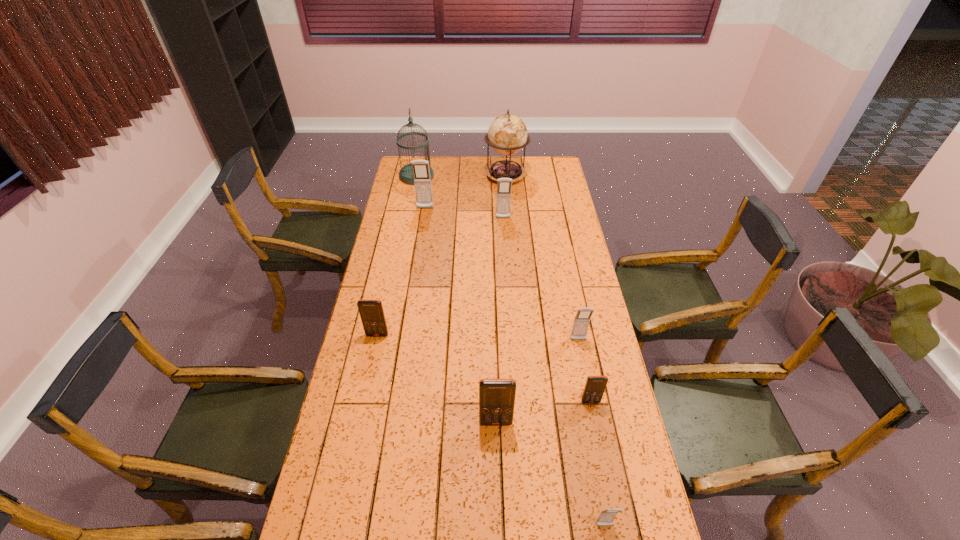
I want to click on the leftmost cellular telephone, so click(371, 312).

Locate an element on the screen. The height and width of the screenshot is (540, 960). the second farthest orange cellular telephone is located at coordinates (595, 386).

Locate an element on the screen. The width and height of the screenshot is (960, 540). the rightmost orange cellular telephone is located at coordinates (595, 386).

You are a GUI agent. You are given a task and a screenshot of the screen. Output one action in this format:
    pyautogui.click(x=<x>, y=<y>)
    Task: Click on the nearest object
    This screenshot has height=540, width=960.
    Given the screenshot: What is the action you would take?
    pyautogui.click(x=606, y=517)

This screenshot has height=540, width=960. Find the location of `the nearest cellular telephone`. the nearest cellular telephone is located at coordinates click(606, 517).

Where is `vacant area situated 0.220m on the front-facing side of the birdcage`? The image size is (960, 540). vacant area situated 0.220m on the front-facing side of the birdcage is located at coordinates (475, 176).

Where is `vacant space located 0.190m at the center of the globe`? The width and height of the screenshot is (960, 540). vacant space located 0.190m at the center of the globe is located at coordinates (509, 211).

What are the coordinates of `vacant area located 0.130m on the front-facing side of the leftmost gray cellular telephone` in the screenshot? It's located at (422, 227).

You are a GUI agent. You are given a task and a screenshot of the screen. Output one action in this format:
    pyautogui.click(x=<x>, y=<y>)
    Task: Click on the vacant space located 0.060m on the front-facing side of the second gray cellular telephone from left to right
    
    Given the screenshot: What is the action you would take?
    pyautogui.click(x=504, y=228)

Where is `vacant space located 0.190m on the screen of the second orange cellular telephone from right to left`? vacant space located 0.190m on the screen of the second orange cellular telephone from right to left is located at coordinates (498, 493).